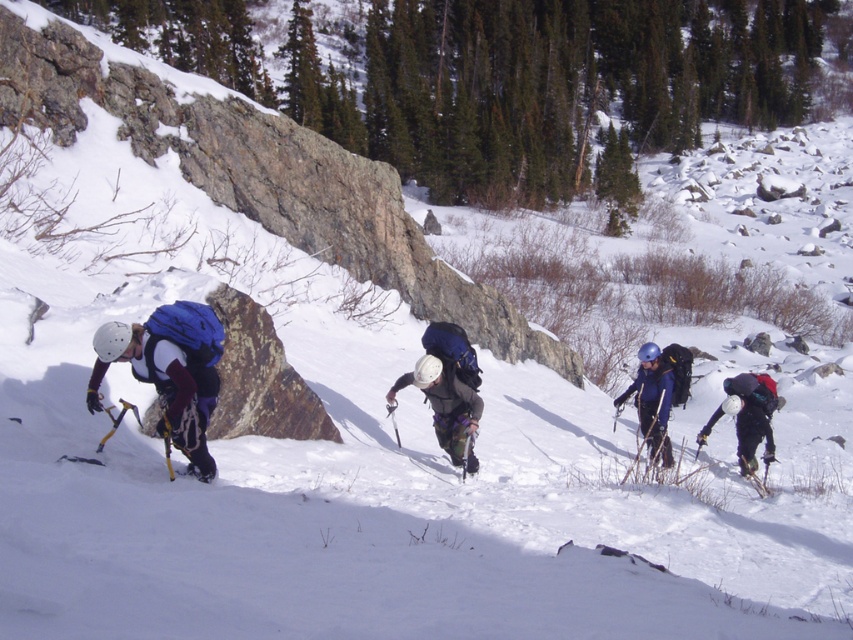
From the picture: Can you confirm if matte white helmet at center is bigger than blue matte helmet at center?

Incorrect, matte white helmet at center is not larger than blue matte helmet at center.

Does matte white helmet at center appear on the right side of blue matte helmet at center?

No, matte white helmet at center is not to the right of blue matte helmet at center.

Locate an element on the screen. The width and height of the screenshot is (853, 640). matte white helmet at center is located at coordinates (445, 404).

What are the coordinates of `matte white helmet at center` in the screenshot? It's located at (445, 404).

Image resolution: width=853 pixels, height=640 pixels. I want to click on matte black backpack at lower right, so click(747, 416).

Can you confirm if matte blue jacket at left is positioned to the left of blue matte helmet at center?

Correct, you'll find matte blue jacket at left to the left of blue matte helmet at center.

Does matte blue jacket at left appear on the right side of blue matte helmet at center?

In fact, matte blue jacket at left is to the left of blue matte helmet at center.

You are a GUI agent. You are given a task and a screenshot of the screen. Output one action in this format:
    pyautogui.click(x=<x>, y=<y>)
    Task: Click on the matte blue jacket at left
    The width and height of the screenshot is (853, 640).
    Given the screenshot: What is the action you would take?
    pyautogui.click(x=169, y=371)

The height and width of the screenshot is (640, 853). I want to click on matte blue jacket at left, so [x=169, y=371].